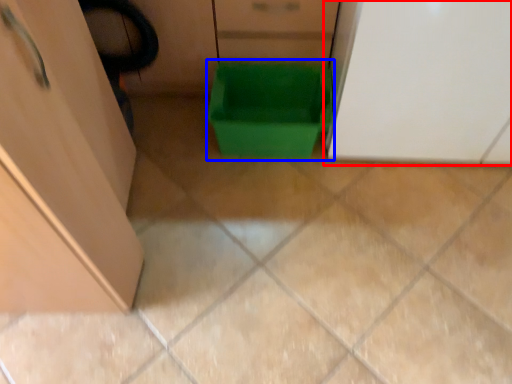
Question: Which point is closer to the camera, cabinetry (highlighted by a red box) or storage box (highlighted by a blue box)?

Choices:
 (A) cabinetry
 (B) storage box

Answer: (A)